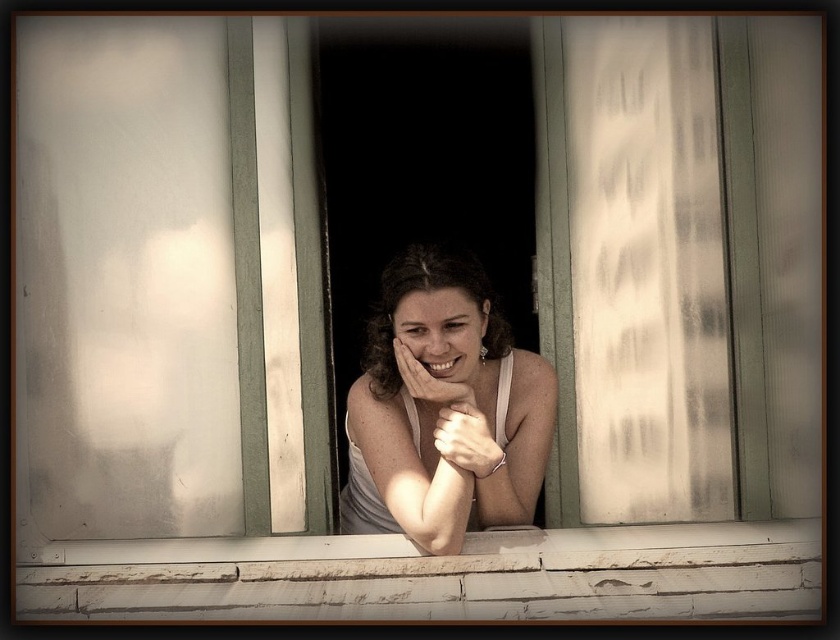
Does white painted wood at center appear on the right side of matte silver bracelet at center?

In fact, white painted wood at center is to the left of matte silver bracelet at center.

Between white painted wood at center and matte silver bracelet at center, which one is positioned lower?

white painted wood at center is lower down.

Between point (659, 598) and point (458, 426), which one is positioned in front?

Positioned in front is point (659, 598).

Locate an element on the screen. The image size is (840, 640). white painted wood at center is located at coordinates (441, 576).

Can you confirm if matte silver bracelet at center is bigger than matte skin hand at center?

No, matte silver bracelet at center is not bigger than matte skin hand at center.

Is matte silver bracelet at center taller than matte skin hand at center?

Indeed, matte silver bracelet at center has a greater height compared to matte skin hand at center.

What do you see at coordinates (466, 440) in the screenshot?
I see `matte silver bracelet at center` at bounding box center [466, 440].

This screenshot has height=640, width=840. In order to click on matte silver bracelet at center in this screenshot , I will do `click(466, 440)`.

The image size is (840, 640). I want to click on matte white tank top at center, so click(x=444, y=408).

Can you confirm if matte white tank top at center is thinner than matte skin hand at center?

In fact, matte white tank top at center might be wider than matte skin hand at center.

Is point (501, 387) farther from camera compared to point (457, 384)?

Yes, point (501, 387) is behind point (457, 384).

I want to click on matte white tank top at center, so click(x=444, y=408).